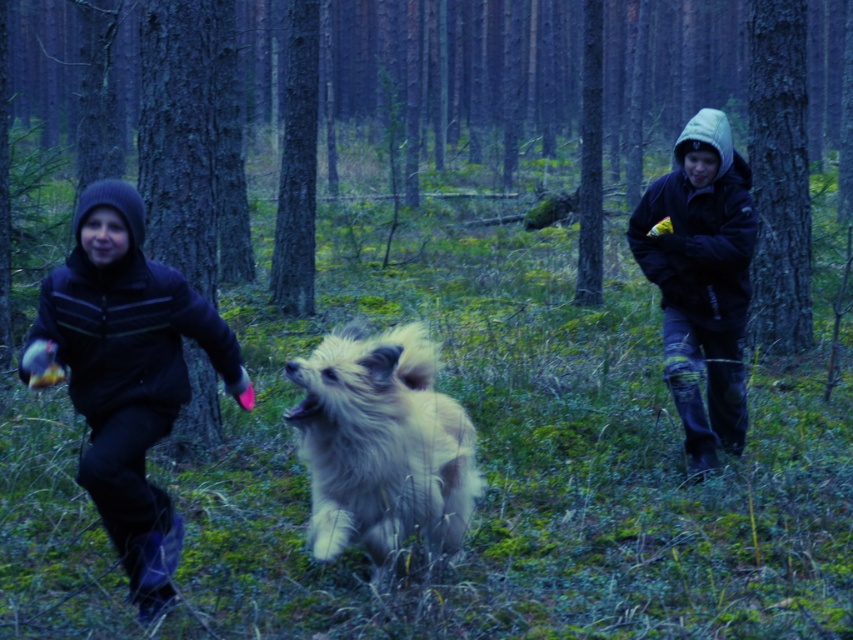
Is black fleece jacket at left smaller than fluffy white dog at center?

Actually, black fleece jacket at left might be larger than fluffy white dog at center.

Identify the location of black fleece jacket at left. (126, 372).

Can you confirm if fluffy white dog at center is positioned below dark blue hooded jacket at right?

Indeed, fluffy white dog at center is positioned under dark blue hooded jacket at right.

Locate an element on the screen. The width and height of the screenshot is (853, 640). fluffy white dog at center is located at coordinates (381, 444).

This screenshot has width=853, height=640. I want to click on fluffy white dog at center, so click(x=381, y=444).

Is black fleece jacket at left further to the viewer compared to dark blue hooded jacket at right?

No.

This screenshot has height=640, width=853. I want to click on black fleece jacket at left, so click(126, 372).

Where is `black fleece jacket at left`? The image size is (853, 640). black fleece jacket at left is located at coordinates tap(126, 372).